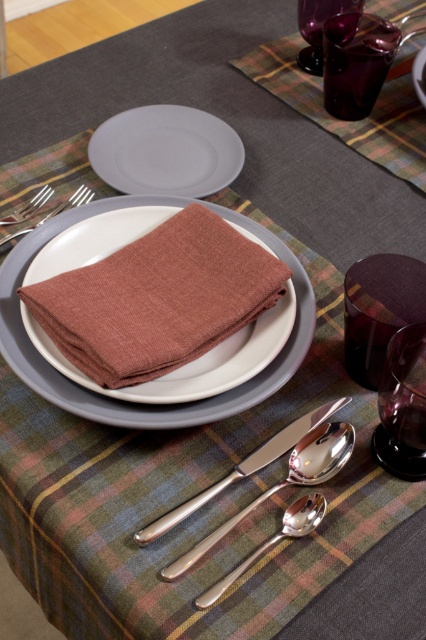
Question: Can you confirm if silver metallic spoon at center is positioned to the left of transparent purple wine glass at upper right?

Choices:
 (A) no
 (B) yes

Answer: (B)

Question: Among these points, which one is nearest to the camera?

Choices:
 (A) (226, 579)
 (B) (161, 164)

Answer: (A)

Question: Does matte gray plate at upper center appear on the left side of matte gray plate at center?

Choices:
 (A) no
 (B) yes

Answer: (B)

Question: Which point appears closest to the camera in this image?

Choices:
 (A) (91, 246)
 (B) (417, 54)
 (C) (9, 224)

Answer: (A)

Question: Observing the image, what is the correct spatial positioning of satin silver spoon at lower center in reference to silver metallic fork at upper left?

Choices:
 (A) below
 (B) above

Answer: (A)

Question: Which of the following is the farthest from the observer?

Choices:
 (A) satin silver spoon at lower center
 (B) brown linen napkin at center

Answer: (B)